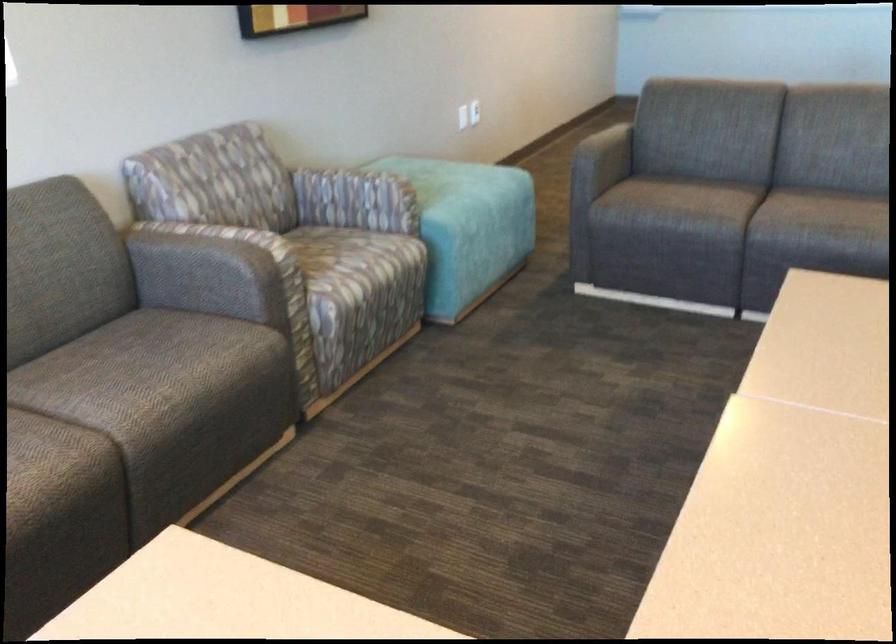
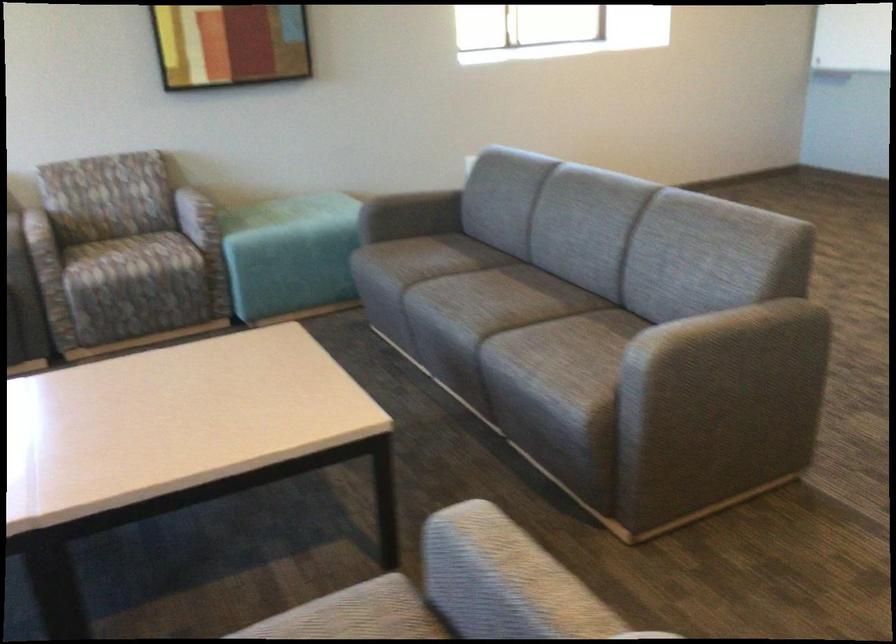
Find the pixel in the second image that matches point 375,193 in the first image.

(197, 216)